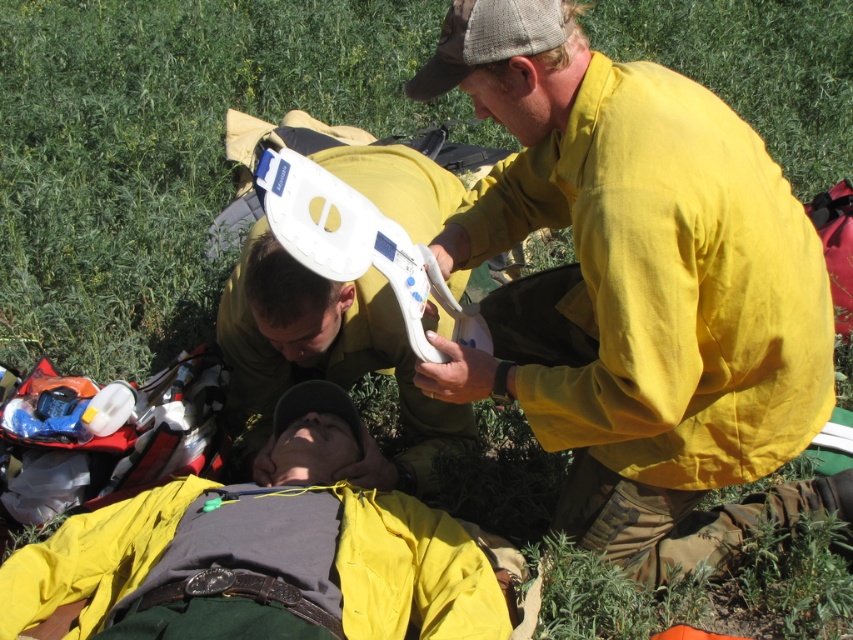
You are a hiker who has just arrived at the scene. You need to locate the yellow fabric shirt at upper right. According to the coordinates provided, where exactly should you look?

The yellow fabric shirt at upper right is located at point (x=636, y=289).

Based on the coordinates provided, where is the yellow fabric shirt at upper right located in the image?

The yellow fabric shirt at upper right is located at the 2D coordinates point (636, 289) in the image.